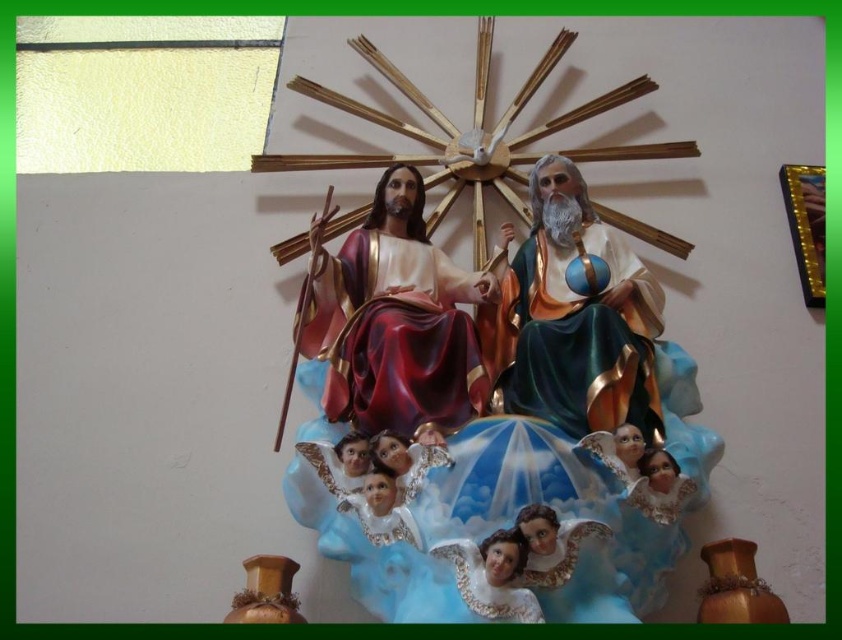
Based on the scene description, where is the shiny red fabric statue at center located in the image?

The shiny red fabric statue at center is located at point [393,320].

You are an art curator planning to install a new lighting system for the matte plastic sculpture at center and the smooth porcelain angel at center. Which object should you place the spotlight on the left side of to ensure it faces the correct direction?

The smooth porcelain angel at center should have the spotlight placed on its left side because the matte plastic sculpture at center is positioned on the right side of it. This arrangement ensures proper illumination from the correct direction.